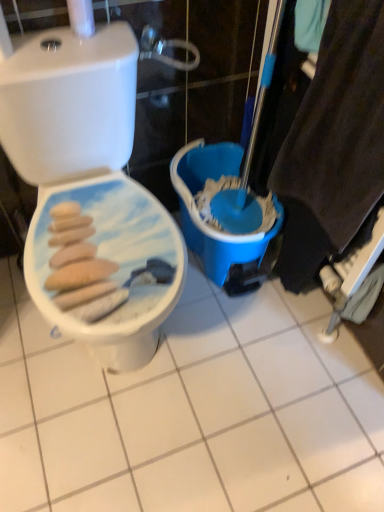
In order to click on free space between blue plastic bucket at center and white glossy toilet seat at left in this screenshot , I will do `click(231, 325)`.